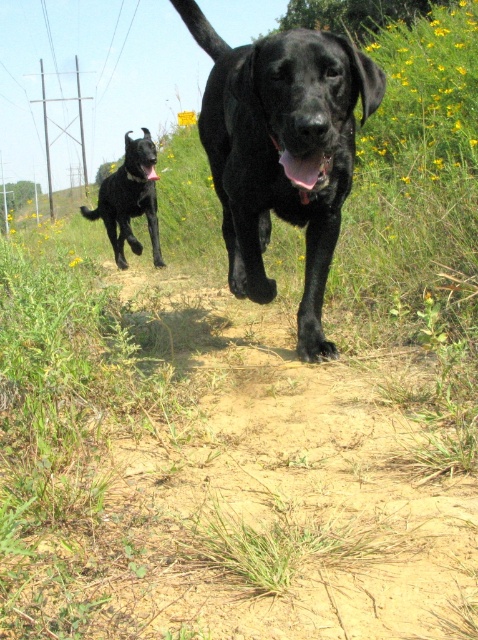
Who is lower down, shiny black dog at center or shiny black dog at upper left?

shiny black dog at center

Does point (232, 257) lie in front of point (119, 179)?

That is True.

The height and width of the screenshot is (640, 478). Identify the location of shiny black dog at center. [282, 150].